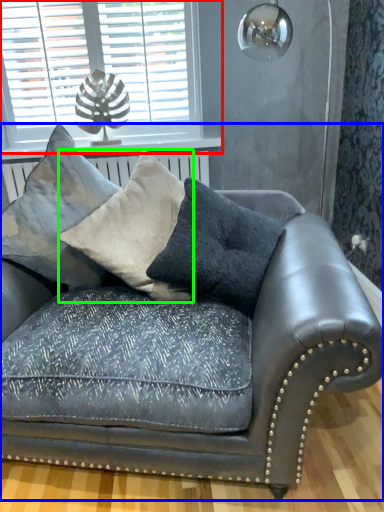
Question: Estimate the real-world distances between objects in this image. Which object is farther from window (highlighted by a red box), studio couch (highlighted by a blue box) or pillow (highlighted by a green box)?

Choices:
 (A) studio couch
 (B) pillow

Answer: (A)